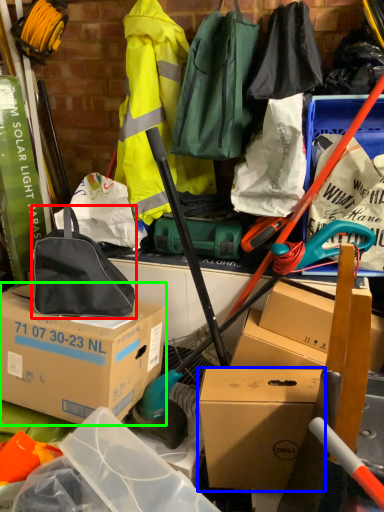
Question: Estimate the real-world distances between objects in this image. Which object is closer to luggage and bags (highlighted by a red box), box (highlighted by a blue box) or box (highlighted by a green box)?

Choices:
 (A) box
 (B) box

Answer: (B)